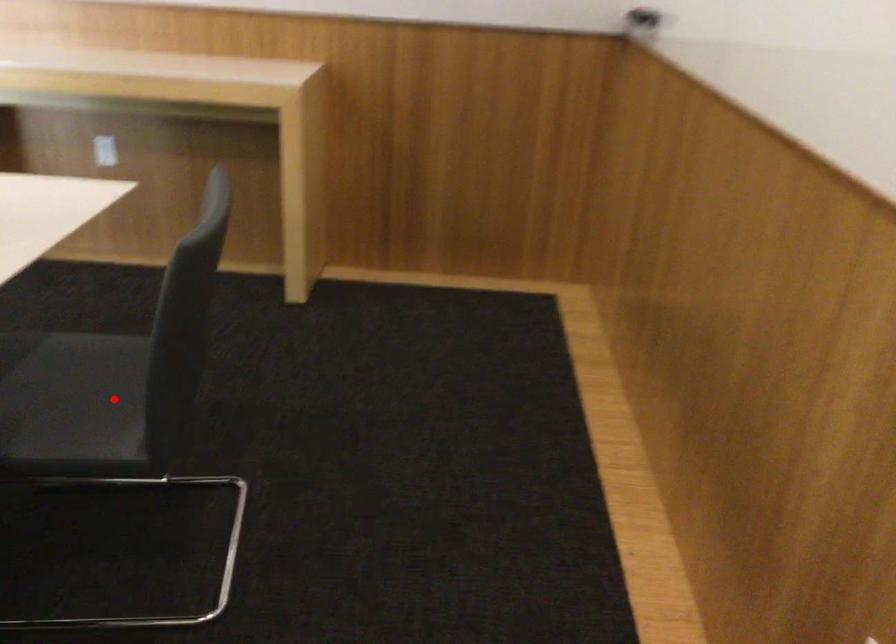
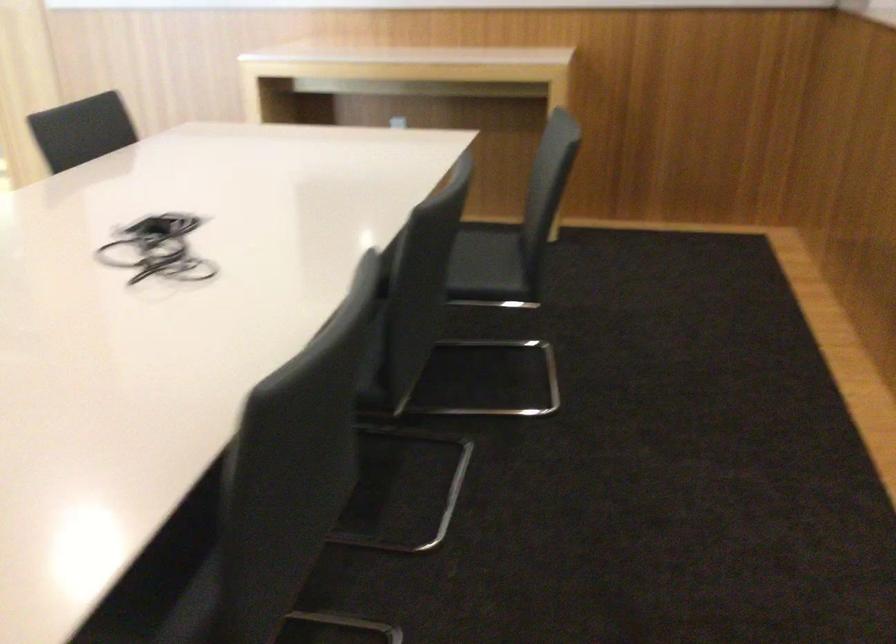
Where in the second image is the point corresponding to the highlighted location from the first image?

(490, 266)